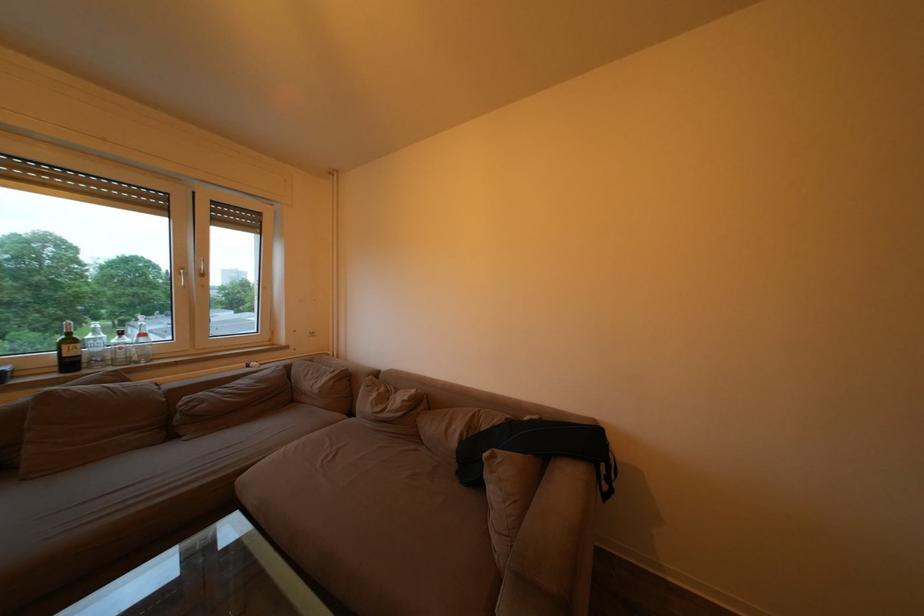
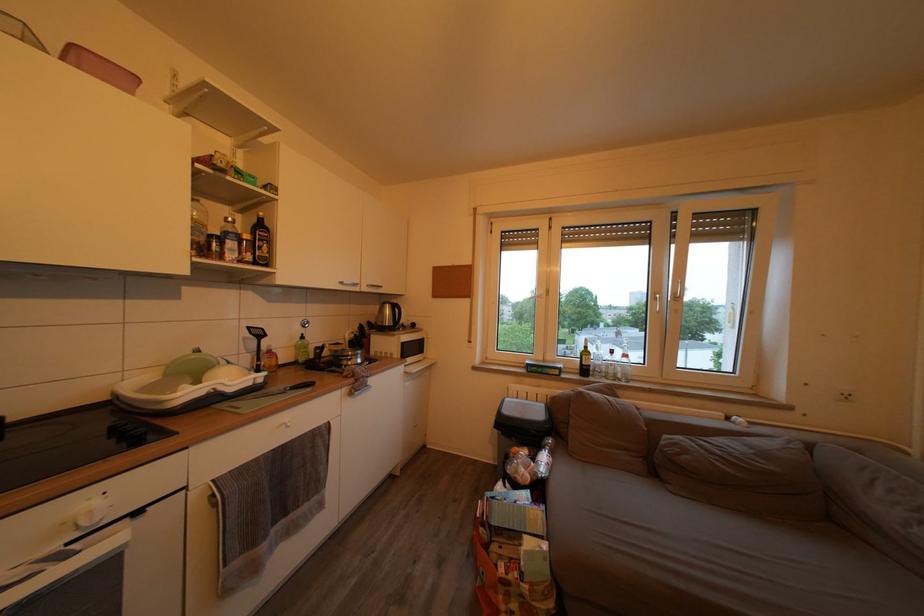
Find the pixel in the second image that matches the point at 128,362 in the first image.

(618, 378)